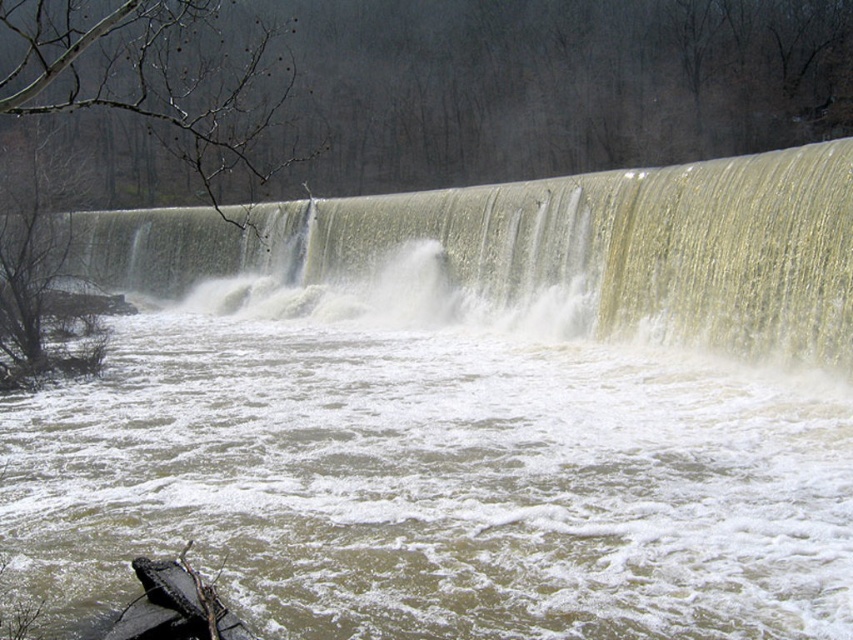
Is point (321, 237) farther from camera compared to point (125, 636)?

Yes, point (321, 237) is behind point (125, 636).

Does greenish-yellow textured waterfall at center have a smaller size compared to black rubber boat at lower left?

Actually, greenish-yellow textured waterfall at center might be larger than black rubber boat at lower left.

Which is behind, point (552, 252) or point (187, 611)?

The point (552, 252) is more distant.

Locate an element on the screen. The width and height of the screenshot is (853, 640). greenish-yellow textured waterfall at center is located at coordinates (550, 246).

Between brown muddy water at center and greenish-yellow textured waterfall at center, which one is positioned lower?

brown muddy water at center is lower down.

Can you confirm if brown muddy water at center is positioned above greenish-yellow textured waterfall at center?

No.

Who is more forward, (3, 481) or (821, 298)?

Point (3, 481) is in front.

You are a GUI agent. You are given a task and a screenshot of the screen. Output one action in this format:
    pyautogui.click(x=<x>, y=<y>)
    Task: Click on the brown muddy water at center
    This screenshot has height=640, width=853.
    Given the screenshot: What is the action you would take?
    pyautogui.click(x=436, y=476)

Is brown muddy water at center below black rubber boat at lower left?

Incorrect, brown muddy water at center is not positioned below black rubber boat at lower left.

Is point (370, 490) closer to viewer compared to point (196, 609)?

No.

The width and height of the screenshot is (853, 640). Find the location of `brown muddy water at center`. brown muddy water at center is located at coordinates (436, 476).